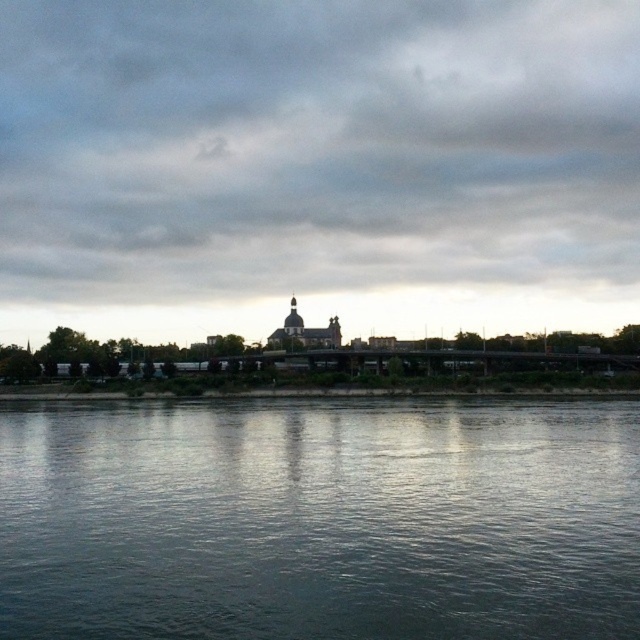
What do you see at coordinates (314, 147) in the screenshot? I see `cloudy sky at upper center` at bounding box center [314, 147].

Which is in front, point (48, 273) or point (227, 630)?

Point (227, 630)

Locate an element on the screen. cloudy sky at upper center is located at coordinates (314, 147).

Find the location of `cloudy sky at upper center`. cloudy sky at upper center is located at coordinates (314, 147).